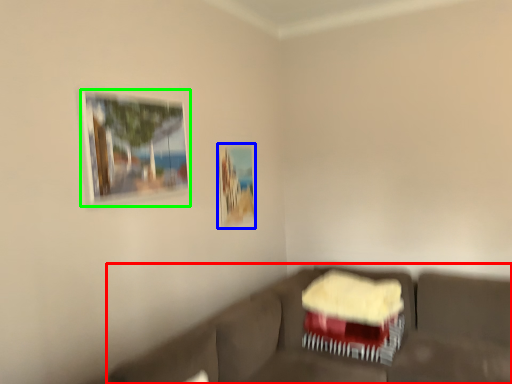
Question: Considering the real-world distances, which object is closest to studio couch (highlighted by a red box)? picture frame (highlighted by a blue box) or picture frame (highlighted by a green box).

Choices:
 (A) picture frame
 (B) picture frame

Answer: (A)